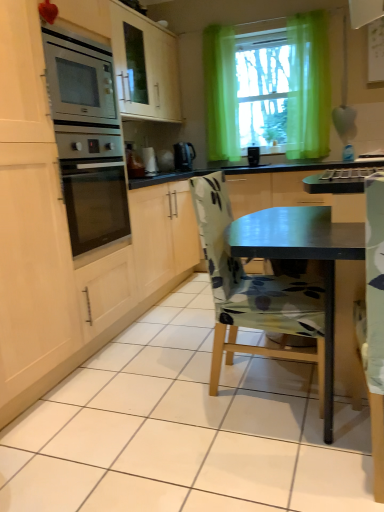
Describe the element at coordinates (149, 161) in the screenshot. I see `white glossy kettle at center` at that location.

Image resolution: width=384 pixels, height=512 pixels. Find the location of `green sheer curtain at upper center`. green sheer curtain at upper center is located at coordinates (309, 88).

Measure the distance between point (292,79) and camera.

Point (292,79) and camera are 11.92 feet apart.

Identify the location of floral fabric chair at center. (252, 291).

Can you confirm if green sheer curtain at upper center is shorter than black plastic kettle at center?

Incorrect, the height of green sheer curtain at upper center does not fall short of that of black plastic kettle at center.

Is green sheer curtain at upper center smaller than black plastic kettle at center?

No, green sheer curtain at upper center is not smaller than black plastic kettle at center.

Considering their positions, is green sheer curtain at upper center located in front of or behind black plastic kettle at center?

Visually, green sheer curtain at upper center is located in front of black plastic kettle at center.

Is green sheer curtain at upper center aimed at black plastic kettle at center?

No, green sheer curtain at upper center is not aimed at black plastic kettle at center.

Considering the sizes of objects green sheer curtain at upper center and floral fabric chair at center in the image provided, who is smaller, green sheer curtain at upper center or floral fabric chair at center?

green sheer curtain at upper center is smaller.

What are the coordinates of `chair on the left of green sheer curtain at upper center` in the screenshot? It's located at (252, 291).

Based on the photo, considering the sizes of green sheer curtain at upper center and floral fabric chair at center in the image, is green sheer curtain at upper center taller or shorter than floral fabric chair at center?

Considering their sizes, green sheer curtain at upper center has more height than floral fabric chair at center.

Consider the image. Do you think green sheer curtain at upper center is within floral fabric chair at center, or outside of it?

The correct answer is: outside.

Which object is positioned more to the left, floral fabric chair at center or white glossy kettle at center?

white glossy kettle at center is more to the left.

From the picture: Which object is further away from the camera, floral fabric chair at center or white glossy kettle at center?

white glossy kettle at center is further away from the camera.

From the image's perspective, relative to white glossy kettle at center, is floral fabric chair at center above or below?

From the image's perspective, floral fabric chair at center appears below white glossy kettle at center.

From a real-world perspective, is floral fabric chair at center under white glossy kettle at center?

Yes, from a real-world perspective, floral fabric chair at center is beneath white glossy kettle at center.

Identify the location of chair that appears below the white glossy kettle at center (from a real-world perspective). The height and width of the screenshot is (512, 384). (252, 291).

From the image's perspective, is white glossy kettle at center positioned above or below floral fabric chair at center?

white glossy kettle at center is situated higher than floral fabric chair at center in the image.

Between white glossy kettle at center and floral fabric chair at center, which one has larger width?

floral fabric chair at center is wider.

Does green sheer curtain at upper center touch floral fabric chair at center?

No, green sheer curtain at upper center is not with floral fabric chair at center.

From a real-world perspective, which is physically above, green sheer curtain at upper center or floral fabric chair at center?

From a 3D spatial view, green sheer curtain at upper center is above.

From the image's perspective, which one is positioned higher, green sheer curtain at upper center or floral fabric chair at center?

green sheer curtain at upper center, from the image's perspective.

Where is `curtain located on the right of floral fabric chair at center`? The height and width of the screenshot is (512, 384). curtain located on the right of floral fabric chair at center is located at coordinates (309, 88).

Where is `window screen that appears behind the green sheer curtain at upper center`? window screen that appears behind the green sheer curtain at upper center is located at coordinates (263, 88).

In the image, is green sheer curtain at upper center positioned in front of or behind green sheer curtain at upper center?

In the image, green sheer curtain at upper center appears in front of green sheer curtain at upper center.

Can we say green sheer curtain at upper center lies outside green sheer curtain at upper center?

Yes, green sheer curtain at upper center is outside of green sheer curtain at upper center.

From the image's perspective, which one is positioned higher, green sheer curtain at upper center or green sheer curtain at upper center?

From the image's view, green sheer curtain at upper center is above.

Is white glossy kettle at center directly adjacent to black plastic kettle at center?

There is a gap between white glossy kettle at center and black plastic kettle at center.

Would you say white glossy kettle at center is inside or outside black plastic kettle at center?

white glossy kettle at center is outside black plastic kettle at center.

Who is shorter, white glossy kettle at center or black plastic kettle at center?

black plastic kettle at center is shorter.

Where is `kitchen appliance below the green sheer curtain at upper center (from a real-world perspective)`? Image resolution: width=384 pixels, height=512 pixels. kitchen appliance below the green sheer curtain at upper center (from a real-world perspective) is located at coordinates (184, 156).

At what (x,y) coordinates should I click in order to perform the action: click on chair in front of the green sheer curtain at upper center. Please return your answer as a coordinate pair (x, y). Looking at the image, I should click on (252, 291).

From the image, which object appears to be nearer to black plastic kettle at center, green sheer curtain at upper center or white glossy kettle at center?

white glossy kettle at center is closer to black plastic kettle at center.

From the image, which object appears to be nearer to green sheer curtain at upper center, white glossy kettle at center or green sheer curtain at upper center?

green sheer curtain at upper center is closer to green sheer curtain at upper center.

When comparing their distances from green sheer curtain at upper center, does white glossy kettle at center or floral fabric chair at center seem closer?

Among the two, white glossy kettle at center is located nearer to green sheer curtain at upper center.

When comparing their distances from green sheer curtain at upper center, does white glossy kettle at center or floral fabric chair at center seem closer?

white glossy kettle at center is closer to green sheer curtain at upper center.

Considering their positions, is green sheer curtain at upper center positioned closer to green sheer curtain at upper center than floral fabric chair at center?

Based on the image, green sheer curtain at upper center appears to be nearer to green sheer curtain at upper center.

When comparing their distances from white glossy kettle at center, does green sheer curtain at upper center or green sheer curtain at upper center seem further?

The object further to white glossy kettle at center is green sheer curtain at upper center.

Estimate the real-world distances between objects in this image. Which object is further from green sheer curtain at upper center, white glossy kettle at center or green sheer curtain at upper center?

Among the two, white glossy kettle at center is located further to green sheer curtain at upper center.

Estimate the real-world distances between objects in this image. Which object is closer to black plastic kettle at center, floral fabric chair at center or white glossy kettle at center?

white glossy kettle at center.

This screenshot has height=512, width=384. What are the coordinates of `curtain between floral fabric chair at center and black plastic kettle at center in the front-back direction` in the screenshot? It's located at (309, 88).

Locate an element on the screen. This screenshot has height=512, width=384. curtain located between floral fabric chair at center and white glossy kettle at center in the depth direction is located at coordinates (309, 88).

Locate an element on the screen. Image resolution: width=384 pixels, height=512 pixels. window screen between floral fabric chair at center and white glossy kettle at center along the z-axis is located at coordinates (263, 88).

The height and width of the screenshot is (512, 384). What are the coordinates of `kitchen appliance between white glossy kettle at center and green sheer curtain at upper center` in the screenshot? It's located at (184, 156).